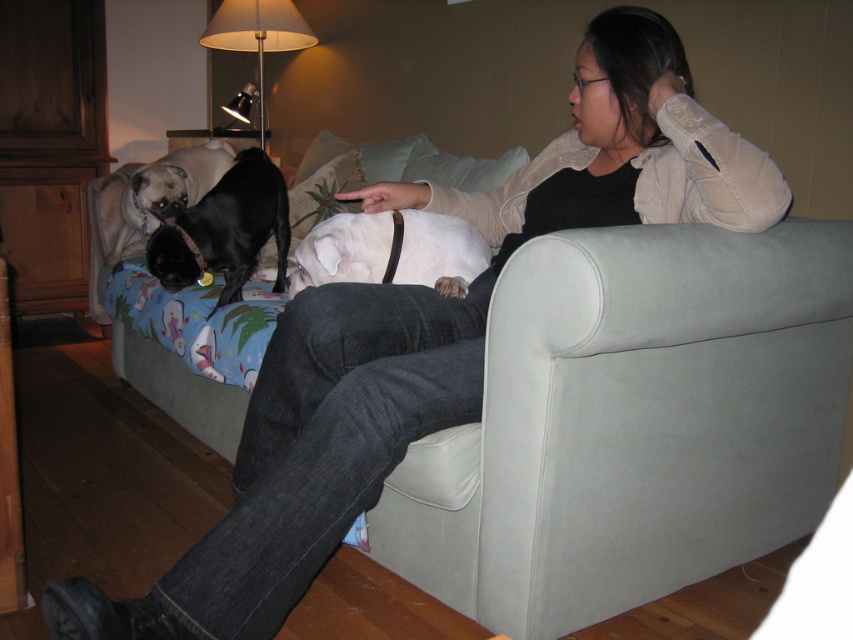
Question: Which of the following is the farthest from the observer?

Choices:
 (A) (170, 168)
 (B) (312, 272)

Answer: (A)

Question: Does black smooth dog at center have a greater width compared to matte black dog at upper left?

Choices:
 (A) yes
 (B) no

Answer: (A)

Question: Is light gray fabric couch at center wider than white matte dog at center?

Choices:
 (A) no
 (B) yes

Answer: (B)

Question: Which object appears farthest from the camera in this image?

Choices:
 (A) light gray fabric couch at center
 (B) black smooth dog at center
 (C) matte black dog at upper left
 (D) white matte dog at center

Answer: (C)

Question: Estimate the real-world distances between objects in this image. Which object is closer to the white matte dog at center?

Choices:
 (A) matte black dog at upper left
 (B) black smooth dog at center

Answer: (B)

Question: Can you confirm if white matte dog at center is thinner than matte black dog at upper left?

Choices:
 (A) yes
 (B) no

Answer: (B)